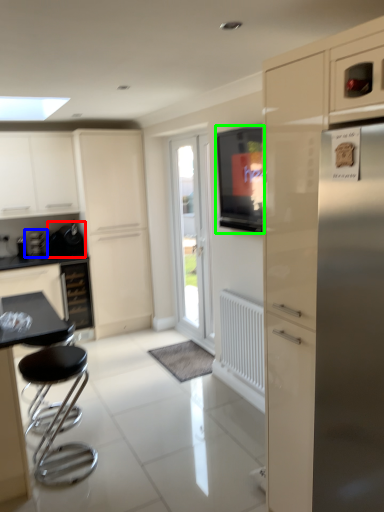
Question: Based on their relative distances, which object is farther from appliance (highlighted by a red box)? Choose from coffee machine (highlighted by a blue box) and window screen (highlighted by a green box).

Choices:
 (A) coffee machine
 (B) window screen

Answer: (B)